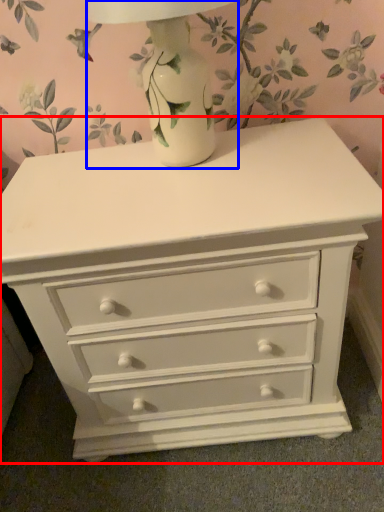
Question: Which point is further to the camera, chest of drawers (highlighted by a red box) or table lamp (highlighted by a blue box)?

Choices:
 (A) chest of drawers
 (B) table lamp

Answer: (A)